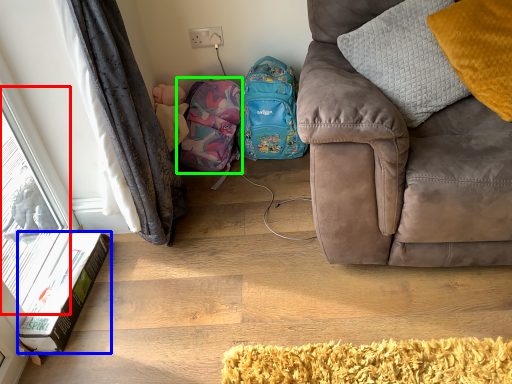
Question: Based on their relative distances, which object is farther from window (highlighted by a red box)? Choose from box (highlighted by a blue box) and bag (highlighted by a green box).

Choices:
 (A) box
 (B) bag

Answer: (B)